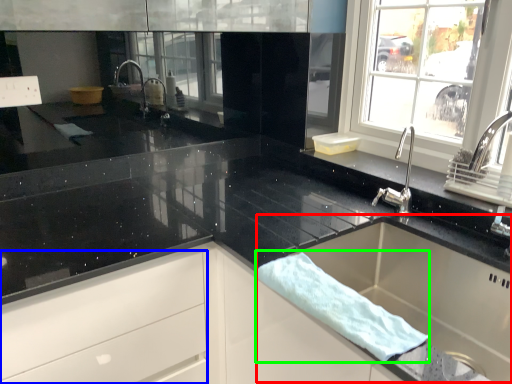
Question: Which object is positioned farthest from sink (highlighted by a red box)? Select from drawer (highlighted by a blue box) and bath towel (highlighted by a green box).

Choices:
 (A) drawer
 (B) bath towel

Answer: (A)